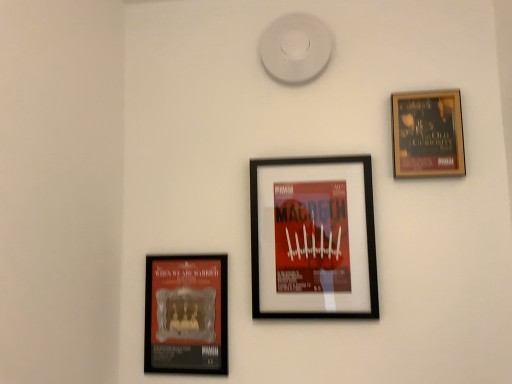
Question: In terms of size, does matte black poster at lower left, the 3th picture frame viewed from the right, appear bigger or smaller than wooden framed poster at upper right, which is the 1th picture frame from right to left?

Choices:
 (A) big
 (B) small

Answer: (A)

Question: Is point (208, 357) closer or farther from the camera than point (437, 102)?

Choices:
 (A) farther
 (B) closer

Answer: (A)

Question: Which is farther from the wooden framed poster at upper right, the third picture frame viewed from the left?

Choices:
 (A) matte black poster at lower left, arranged as the first picture frame when viewed from the left
 (B) black matte picture frame at center, arranged as the second picture frame when viewed from the left

Answer: (A)

Question: Estimate the real-world distances between objects in this image. Which object is closer to the matte black poster at lower left, arranged as the first picture frame when viewed from the left?

Choices:
 (A) black matte picture frame at center, arranged as the second picture frame when viewed from the left
 (B) wooden framed poster at upper right, the third picture frame viewed from the left

Answer: (A)